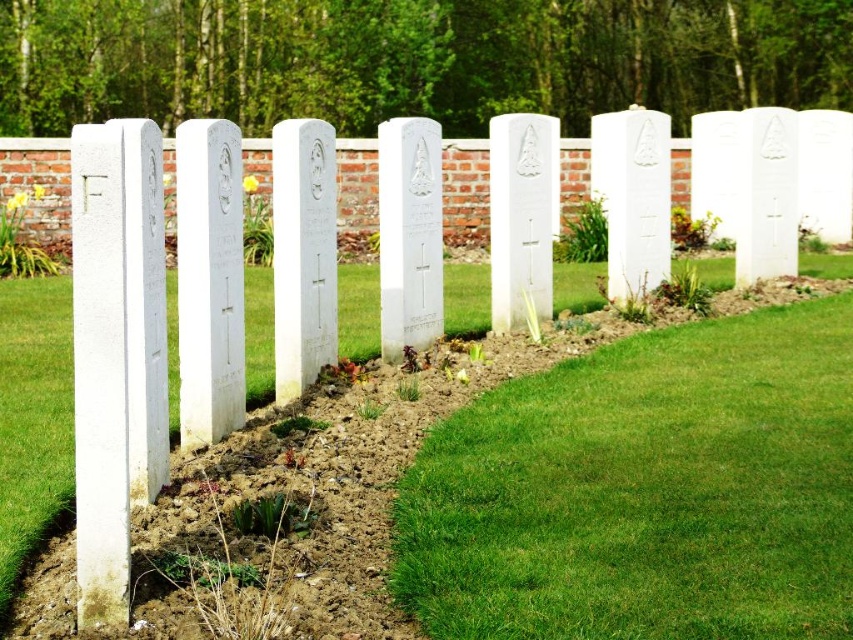
Between point (672, 541) and point (421, 611), which one is positioned in front?

Point (421, 611)

Can you confirm if green grass at center is smaller than green grass at lower right?

Correct, green grass at center occupies less space than green grass at lower right.

Who is more forward, (527, 605) or (567, 464)?

Positioned in front is point (527, 605).

Identify the location of green grass at center. (646, 490).